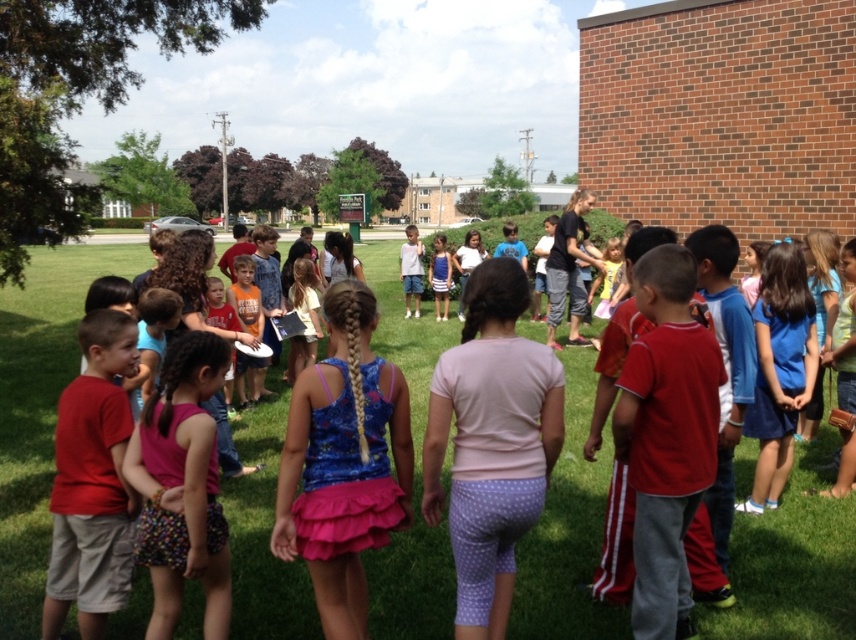
Between point (405, 422) and point (165, 436), which one is positioned behind?

The point (165, 436) is more distant.

Between blue printed tank top at center and multicolored fabric shorts at center, which one appears on the left side from the viewer's perspective?

multicolored fabric shorts at center

Who is more forward, (349, 502) or (147, 467)?

Positioned in front is point (349, 502).

What are the coordinates of `blue printed tank top at center` in the screenshot? It's located at (343, 464).

Between pink fabric shirt at center and matte red shirt at left, which one has less height?

Standing shorter between the two is matte red shirt at left.

At what (x,y) coordinates should I click in order to perform the action: click on pink fabric shirt at center. Please return your answer as a coordinate pair (x, y). This screenshot has height=640, width=856. Looking at the image, I should click on (491, 444).

Is point (497, 300) closer to viewer compared to point (90, 499)?

Yes, point (497, 300) is closer to viewer.

The height and width of the screenshot is (640, 856). Find the location of `pink fabric shirt at center`. pink fabric shirt at center is located at coordinates (491, 444).

Which is in front, point (544, 609) or point (128, 458)?

Positioned in front is point (128, 458).

Can you confirm if green grass at center is positioned above multicolored fabric shorts at center?

Yes.

Who is more distant from viewer, (x=813, y=515) or (x=175, y=497)?

The point (x=813, y=515) is behind.

Find the location of a particular element. This screenshot has width=856, height=640. green grass at center is located at coordinates (37, 410).